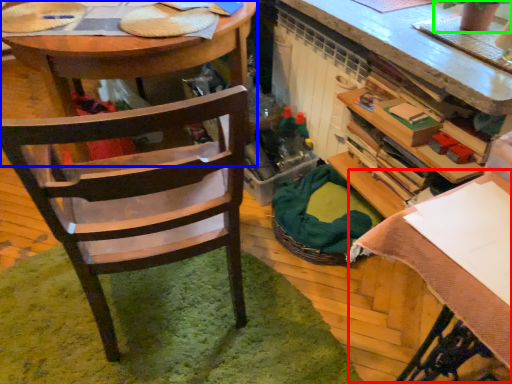
Question: Which object is positioned farthest from table (highlighted by a red box)? Select from desk (highlighted by a blue box) and houseplant (highlighted by a green box).

Choices:
 (A) desk
 (B) houseplant

Answer: (A)